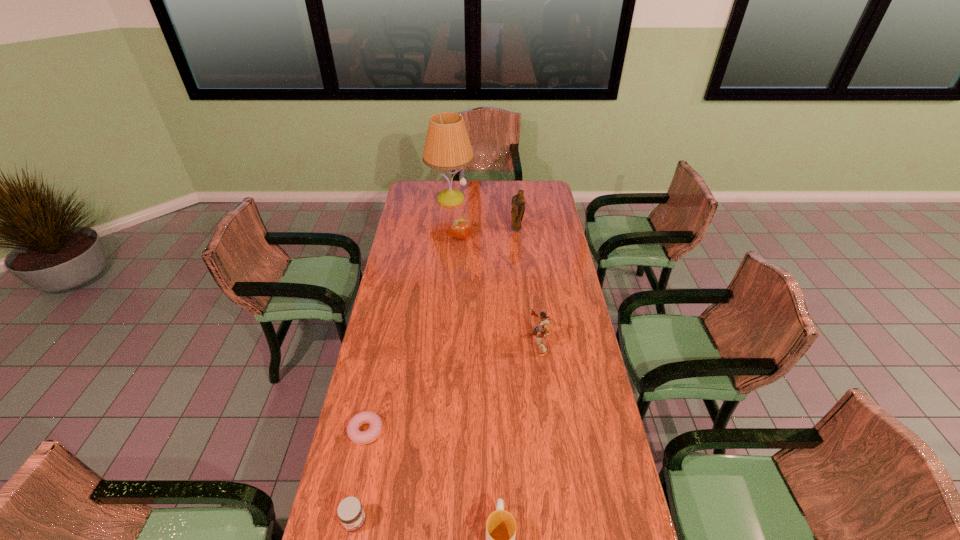
At what (x,y) coordinates should I click in order to perform the action: click on object that is at the far left corner. Please return your answer as a coordinate pair (x, y). This screenshot has width=960, height=540. Looking at the image, I should click on (447, 147).

Where is `vacant space at the far edge`? The height and width of the screenshot is (540, 960). vacant space at the far edge is located at coordinates point(445,180).

This screenshot has height=540, width=960. Identify the location of blank space at the left edge of the desktop. (397, 290).

In the image, there is a desktop. Where is `vacant space at the right edge`? vacant space at the right edge is located at coordinates (535, 215).

The height and width of the screenshot is (540, 960). In the image, there is a desktop. Find the location of `vacant space at the far left corner`. vacant space at the far left corner is located at coordinates (434, 182).

Locate an element on the screen. free space between the doughnut and the lamp is located at coordinates (408, 315).

Identify the location of free space between the doughnut and the tallest object. (408, 315).

Locate an element on the screen. vacant space that is in between the tallest object and the apple is located at coordinates (456, 218).

The width and height of the screenshot is (960, 540). What are the coordinates of `vacant space that's between the sixth shortest object and the lamp` in the screenshot? It's located at (484, 215).

This screenshot has height=540, width=960. In order to click on free spot between the sixth shortest object and the apple in this screenshot , I will do `click(489, 234)`.